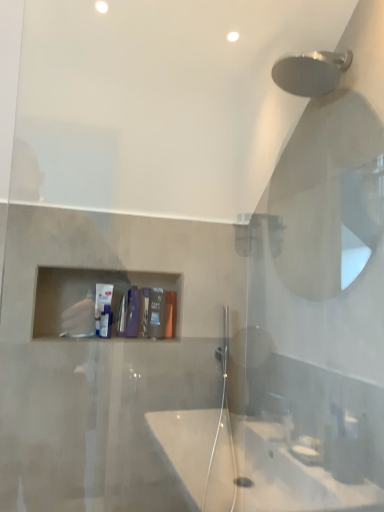
What are the coordinates of `matte black soap at center, acting as the 2th toiletry starting from the right` in the screenshot? It's located at (156, 313).

How much distance is there between matte plastic container at center, the first toiletry from the right, and matte black soap at center, which is the 2th toiletry from left to right?

matte plastic container at center, the first toiletry from the right, is 1.49 inches away from matte black soap at center, which is the 2th toiletry from left to right.

From the matte black soap at center, acting as the 2th toiletry starting from the right, count 2nd toiletrys backward and point to it. Please provide its 2D coordinates.

[(170, 314)]

Considering the relative sizes of matte plastic container at center, the first toiletry from the right, and matte black soap at center, which is the 2th toiletry from left to right, in the image provided, is matte plastic container at center, the first toiletry from the right, taller than matte black soap at center, which is the 2th toiletry from left to right,?

Yes.

Is the depth of matte plastic container at center, marked as the 3th toiletry in a left-to-right arrangement, less than that of matte black soap at center, which is the 2th toiletry from left to right?

No, matte plastic container at center, marked as the 3th toiletry in a left-to-right arrangement, is further to the viewer.

Consider the image. Is matte black soap at center, acting as the 2th toiletry starting from the right, further to the viewer compared to matte plastic container at center, the first toiletry from the right?

No, matte black soap at center, acting as the 2th toiletry starting from the right, is closer to the camera.

In the scene shown: Which object is positioned more to the right, matte black soap at center, which is the 2th toiletry from left to right, or matte plastic container at center, the first toiletry from the right?

From the viewer's perspective, matte plastic container at center, the first toiletry from the right, appears more on the right side.

Based on the photo, does matte black soap at center, which is the 2th toiletry from left to right, have a lesser width compared to matte plastic container at center, marked as the 3th toiletry in a left-to-right arrangement?

Yes.

Is matte black soap at center, which is the 2th toiletry from left to right, far from matte plastic container at center, the first toiletry from the right?

No, matte black soap at center, which is the 2th toiletry from left to right, is not far from matte plastic container at center, the first toiletry from the right.

From their relative heights in the image, would you say white matte tube at center, positioned as the 3th toiletry in right-to-left order, is taller or shorter than matte plastic container at center, marked as the 3th toiletry in a left-to-right arrangement?

white matte tube at center, positioned as the 3th toiletry in right-to-left order, is taller than matte plastic container at center, marked as the 3th toiletry in a left-to-right arrangement.

Is matte plastic container at center, marked as the 3th toiletry in a left-to-right arrangement, at the back of white matte tube at center, positioned as the 3th toiletry in right-to-left order?

white matte tube at center, positioned as the 3th toiletry in right-to-left order, does not have its back to matte plastic container at center, marked as the 3th toiletry in a left-to-right arrangement.

Is white matte tube at center, which is the 1th toiletry from left to right, beside matte plastic container at center, marked as the 3th toiletry in a left-to-right arrangement?

No.

Based on the photo, could you measure the distance between white matte tube at center, positioned as the 3th toiletry in right-to-left order, and matte plastic container at center, marked as the 3th toiletry in a left-to-right arrangement?

They are 10.87 inches apart.

From the image's perspective, is matte black soap at center, acting as the 2th toiletry starting from the right, beneath white matte tube at center, which is the 1th toiletry from left to right?

Correct, matte black soap at center, acting as the 2th toiletry starting from the right, appears lower than white matte tube at center, which is the 1th toiletry from left to right, in the image.

Is matte black soap at center, which is the 2th toiletry from left to right, oriented towards white matte tube at center, positioned as the 3th toiletry in right-to-left order?

No.

Between matte black soap at center, which is the 2th toiletry from left to right, and white matte tube at center, positioned as the 3th toiletry in right-to-left order, which one is positioned behind?

Positioned behind is white matte tube at center, positioned as the 3th toiletry in right-to-left order.

Can you tell me how much matte black soap at center, acting as the 2th toiletry starting from the right, and white matte tube at center, which is the 1th toiletry from left to right, differ in facing direction?

There is a 1.53-degree angle between the facing directions of matte black soap at center, acting as the 2th toiletry starting from the right, and white matte tube at center, which is the 1th toiletry from left to right.

Where is `toiletry above the matte plastic container at center, marked as the 3th toiletry in a left-to-right arrangement (from a real-world perspective)`? The height and width of the screenshot is (512, 384). toiletry above the matte plastic container at center, marked as the 3th toiletry in a left-to-right arrangement (from a real-world perspective) is located at coordinates (102, 301).

Between matte plastic container at center, the first toiletry from the right, and white matte tube at center, which is the 1th toiletry from left to right, which one has smaller width?

white matte tube at center, which is the 1th toiletry from left to right.

Does point (96, 292) lie in front of point (156, 326)?

Yes.

From the image's perspective, is white matte tube at center, which is the 1th toiletry from left to right, under matte black soap at center, acting as the 2th toiletry starting from the right?

No, from the image's perspective, white matte tube at center, which is the 1th toiletry from left to right, is not below matte black soap at center, acting as the 2th toiletry starting from the right.

Is white matte tube at center, positioned as the 3th toiletry in right-to-left order, facing towards matte black soap at center, acting as the 2th toiletry starting from the right?

No, white matte tube at center, positioned as the 3th toiletry in right-to-left order, is not facing towards matte black soap at center, acting as the 2th toiletry starting from the right.

Identify the location of toiletry below the matte plastic container at center, the first toiletry from the right (from a real-world perspective). The image size is (384, 512). (156, 313).

Identify the location of the 2nd toiletry in front of the matte plastic container at center, the first toiletry from the right, counting from the anchor's position. This screenshot has width=384, height=512. (156, 313).

Looking at the image, which one is located closer to matte black soap at center, which is the 2th toiletry from left to right, matte plastic container at center, marked as the 3th toiletry in a left-to-right arrangement, or white matte tube at center, positioned as the 3th toiletry in right-to-left order?

Among the two, matte plastic container at center, marked as the 3th toiletry in a left-to-right arrangement, is located nearer to matte black soap at center, which is the 2th toiletry from left to right.

When comparing their distances from matte plastic container at center, marked as the 3th toiletry in a left-to-right arrangement, does white matte tube at center, which is the 1th toiletry from left to right, or matte black soap at center, acting as the 2th toiletry starting from the right, seem closer?

matte black soap at center, acting as the 2th toiletry starting from the right, is closer to matte plastic container at center, marked as the 3th toiletry in a left-to-right arrangement.

When comparing their distances from matte plastic container at center, the first toiletry from the right, does matte black soap at center, acting as the 2th toiletry starting from the right, or white matte tube at center, which is the 1th toiletry from left to right, seem further?

white matte tube at center, which is the 1th toiletry from left to right, is further to matte plastic container at center, the first toiletry from the right.

From the image, which object appears to be farther from matte black soap at center, acting as the 2th toiletry starting from the right, white matte tube at center, positioned as the 3th toiletry in right-to-left order, or matte plastic container at center, marked as the 3th toiletry in a left-to-right arrangement?

The object further to matte black soap at center, acting as the 2th toiletry starting from the right, is white matte tube at center, positioned as the 3th toiletry in right-to-left order.

When comparing their distances from white matte tube at center, which is the 1th toiletry from left to right, does matte black soap at center, which is the 2th toiletry from left to right, or matte plastic container at center, marked as the 3th toiletry in a left-to-right arrangement, seem further?

matte plastic container at center, marked as the 3th toiletry in a left-to-right arrangement, is positioned further to the anchor white matte tube at center, which is the 1th toiletry from left to right.

Estimate the real-world distances between objects in this image. Which object is closer to white matte tube at center, positioned as the 3th toiletry in right-to-left order, matte plastic container at center, marked as the 3th toiletry in a left-to-right arrangement, or matte black soap at center, acting as the 2th toiletry starting from the right?

Among the two, matte black soap at center, acting as the 2th toiletry starting from the right, is located nearer to white matte tube at center, positioned as the 3th toiletry in right-to-left order.

This screenshot has width=384, height=512. I want to click on toiletry between white matte tube at center, which is the 1th toiletry from left to right, and matte plastic container at center, marked as the 3th toiletry in a left-to-right arrangement, from left to right, so click(x=156, y=313).